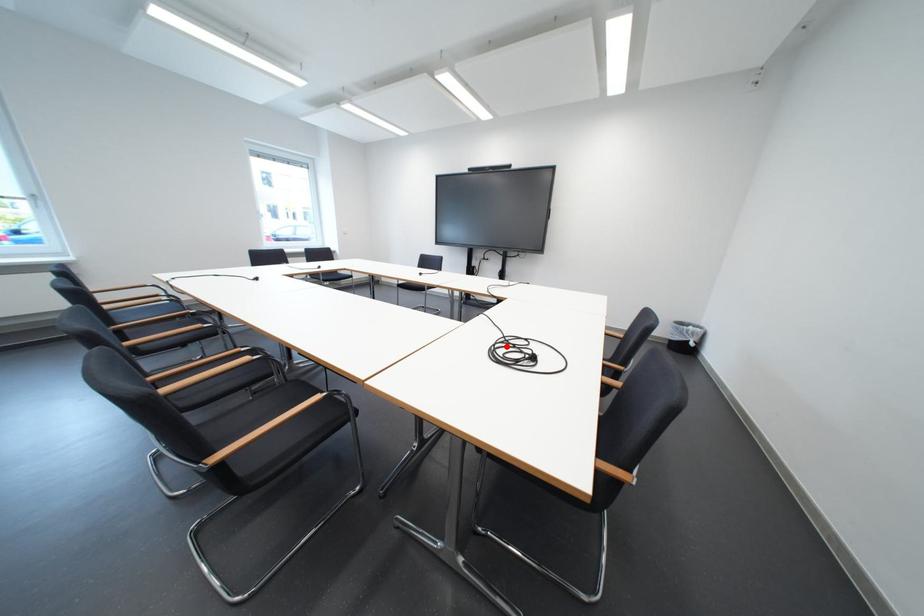
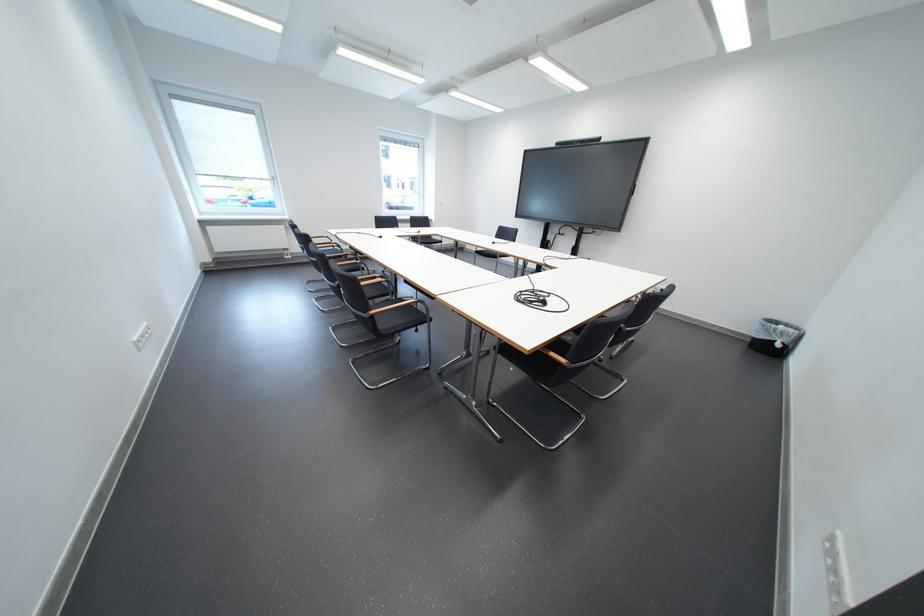
Locate, in the second image, the point that corresponds to the highlighted location in the first image.

(533, 294)